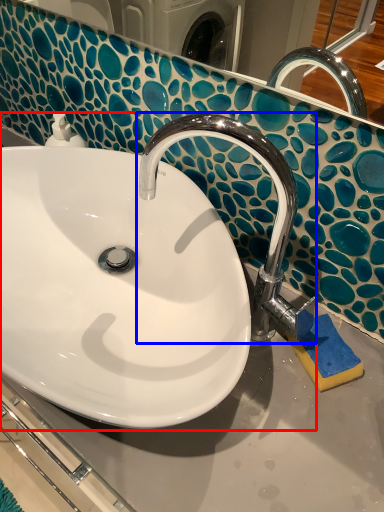
Question: Which object appears closest to the camera in this image, sink (highlighted by a red box) or tap (highlighted by a blue box)?

Choices:
 (A) sink
 (B) tap

Answer: (A)